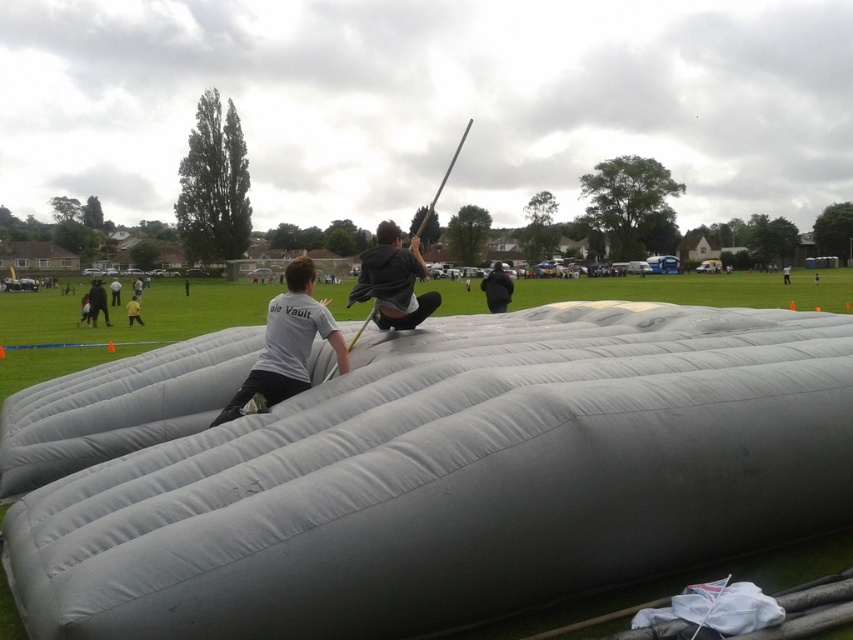
Question: Which object is positioned closest to the matte gray shirt at center?

Choices:
 (A) black matte jacket at center
 (B) yellow fabric at lower left
 (C) gray rubber inflatable at center

Answer: (C)

Question: Which of the following is the closest to the observer?

Choices:
 (A) (387, 310)
 (B) (112, 291)
 (C) (100, 294)

Answer: (A)

Question: Is yellow fabric at lower left smaller than light gray fabric at center?

Choices:
 (A) yes
 (B) no

Answer: (A)

Question: From the image, what is the correct spatial relationship of gray rubber inflatable at center in relation to dark gray hoodie at center?

Choices:
 (A) left
 (B) right

Answer: (A)

Question: Is gray fabric person at left below gray fabric person at center?

Choices:
 (A) no
 (B) yes

Answer: (B)

Question: Which of the following is the closest to the observer?

Choices:
 (A) (129, 310)
 (B) (785, 282)
 (C) (134, 296)

Answer: (A)